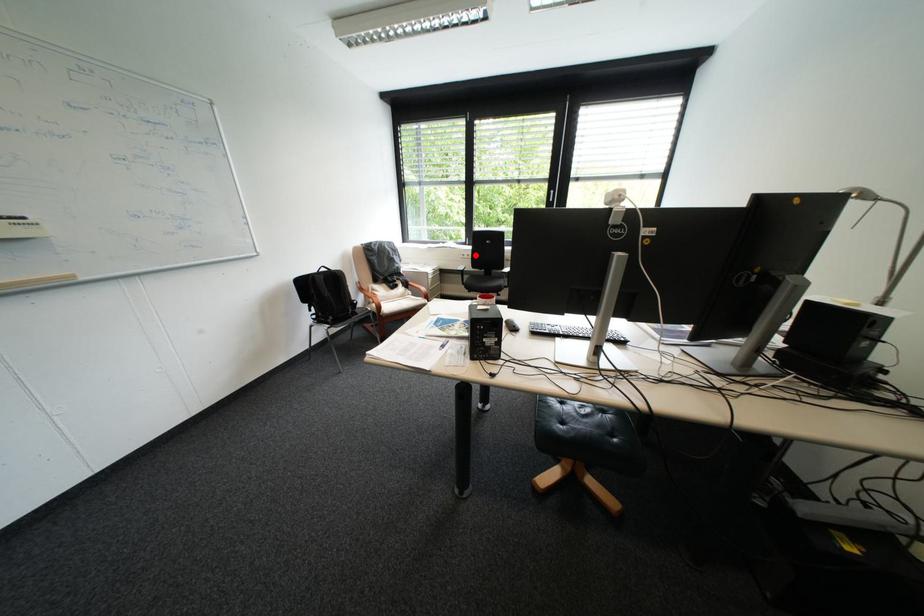
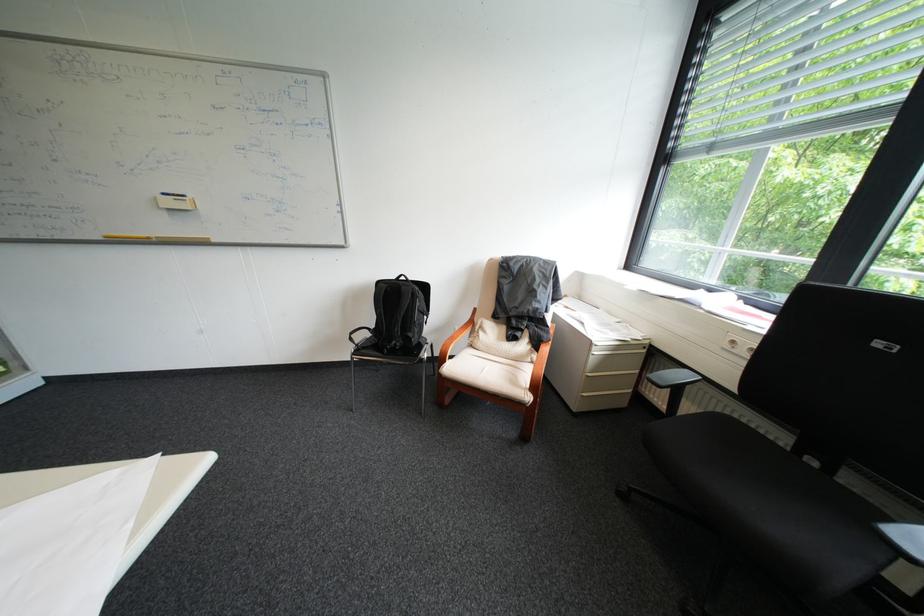
Question: I am providing you with two images of the same scene from different viewpoints. Given a red point in image1, look at the same physical point in image2. Is it:

Choices:
 (A) Closer to the viewpoint
 (B) Farther from the viewpoint

Answer: (B)